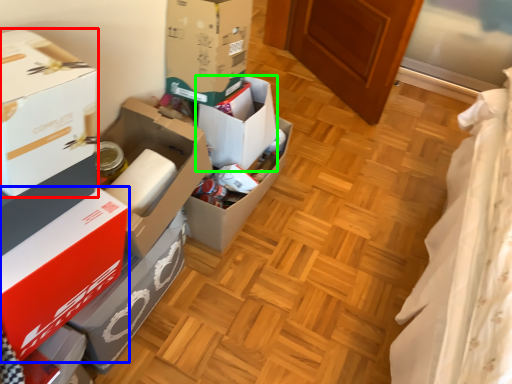
Question: Based on their relative distances, which object is nearer to box (highlighted by a red box)? Choose from box (highlighted by a blue box) and box (highlighted by a green box).

Choices:
 (A) box
 (B) box

Answer: (A)